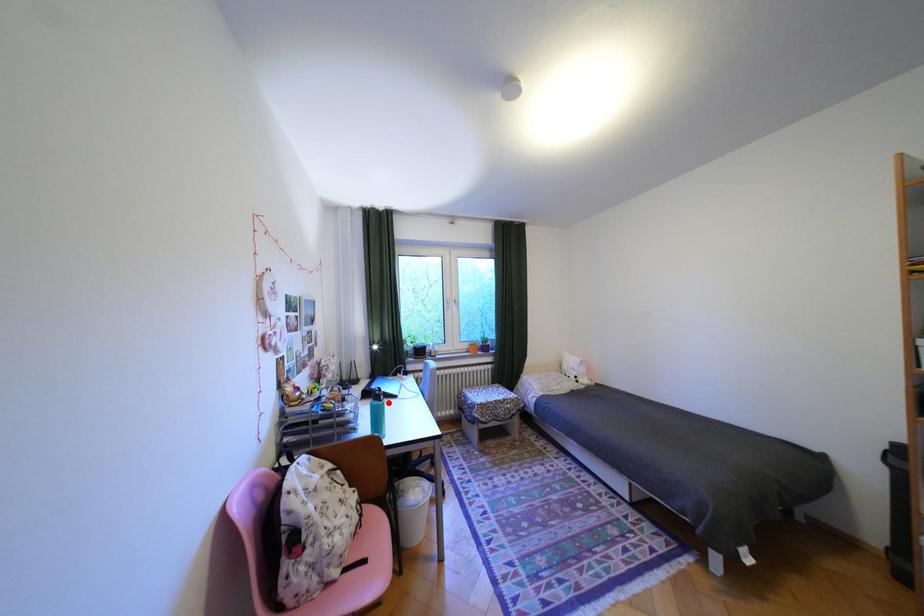
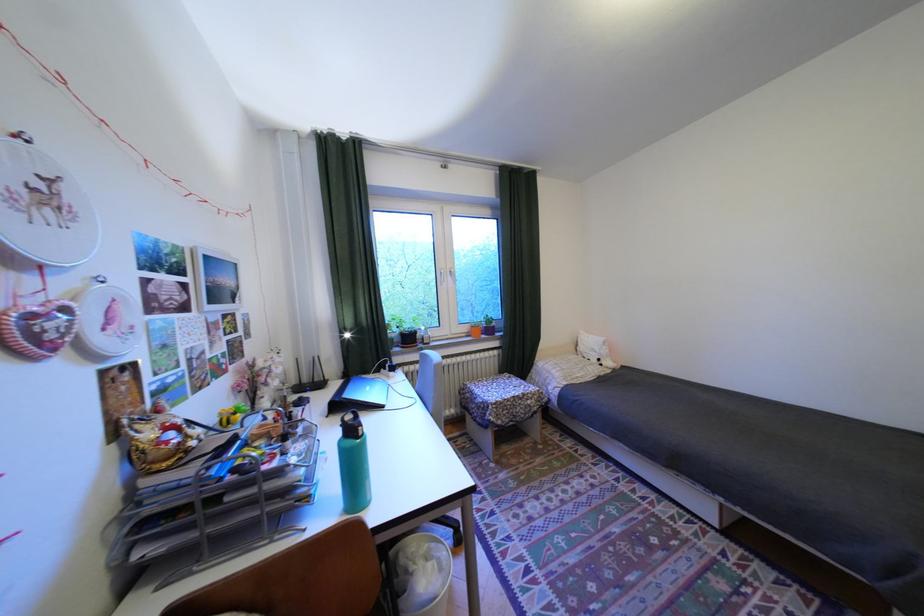
In the second image, find the point that corresponds to the highlighted location in the first image.

(361, 443)